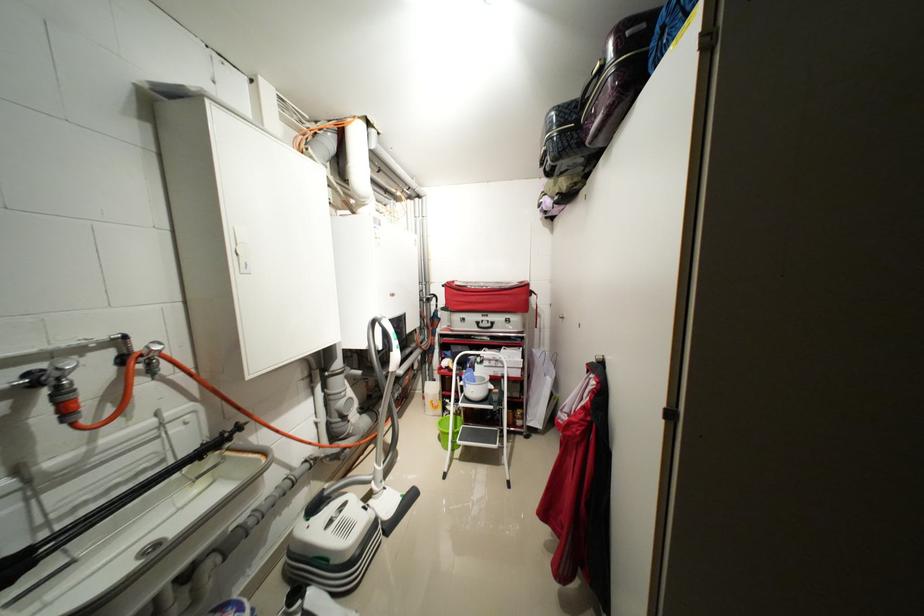
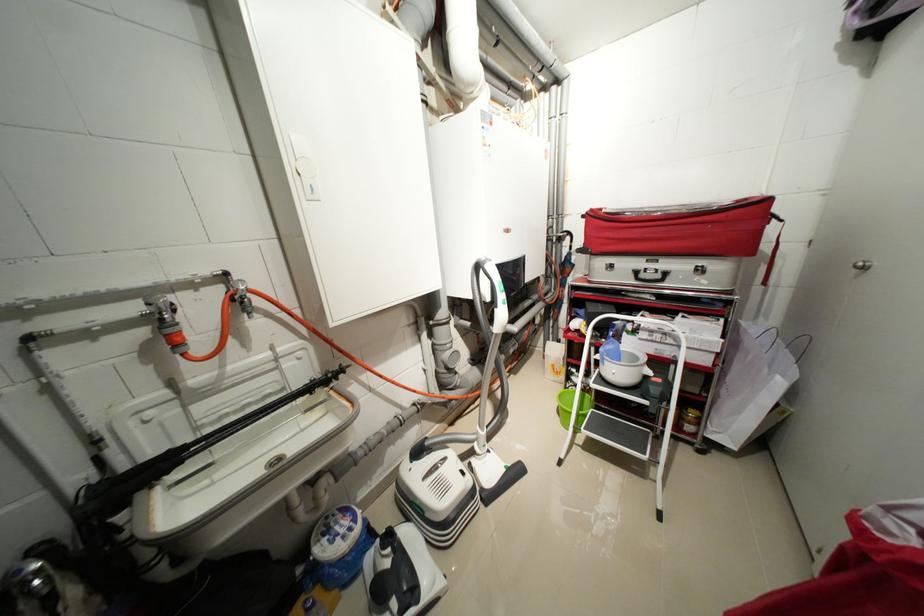
Find the pixel in the second image that matches the point at 157,360 in the first image.

(249, 299)